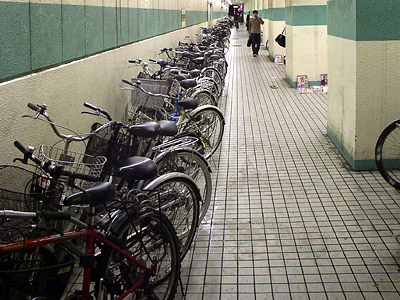
This screenshot has height=300, width=400. Identify the location of tile floor. (277, 138).